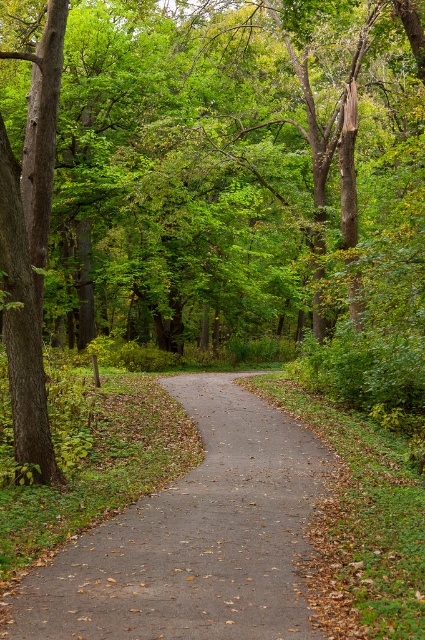
You are standing at the starting point of the forest path and notice a specific point marked at coordinates (195, 538). What material is located at this point?

The point at coordinates (195, 538) corresponds to dull gray asphalt at center.

You are a hiker trying to cross the forest path. You have a 1.5 meter wide tent to carry. The path is bordered by the dull gray asphalt at center and the brown rough bark tree at left. Can you fit your tent between them without touching either?

The dull gray asphalt at center might be wider than brown rough bark tree at left. Since the path might be wider than the tree, the tent could fit if the available space between them is at least 1.5 meters. However, without exact measurements, it is uncertain.